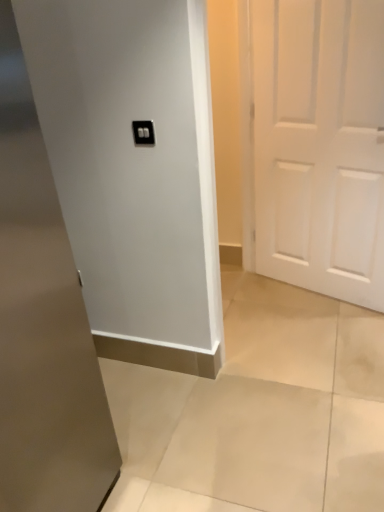
Question: Considering the relative positions of white matte door at right, acting as the first door starting from the back, and black plastic light switch at upper center in the image provided, is white matte door at right, acting as the first door starting from the back, to the right of black plastic light switch at upper center from the viewer's perspective?

Choices:
 (A) no
 (B) yes

Answer: (B)

Question: Is white matte door at right, acting as the first door starting from the back, smaller than black plastic light switch at upper center?

Choices:
 (A) no
 (B) yes

Answer: (A)

Question: From the image's perspective, is white matte door at right, placed as the 1th door when sorted from right to left, on black plastic light switch at upper center?

Choices:
 (A) no
 (B) yes

Answer: (B)

Question: Is white matte door at right, which is the second door from left to right, aimed at black plastic light switch at upper center?

Choices:
 (A) yes
 (B) no

Answer: (A)

Question: Is white matte door at right, acting as the first door starting from the back, positioned beyond the bounds of black plastic light switch at upper center?

Choices:
 (A) no
 (B) yes

Answer: (B)

Question: From the image's perspective, is white matte door at right, placed as the 1th door when sorted from right to left, located above or below white glossy door at center, the second door when ordered from back to front?

Choices:
 (A) below
 (B) above

Answer: (B)

Question: Is white matte door at right, which is the second door from left to right, in front of or behind white glossy door at center, the 1th door from the left, in the image?

Choices:
 (A) behind
 (B) front

Answer: (A)

Question: Would you say white matte door at right, which is the second door from left to right, is to the left or to the right of white glossy door at center, the 1th door from the left, in the picture?

Choices:
 (A) right
 (B) left

Answer: (A)

Question: Considering the positions of white matte door at right, arranged as the second door when viewed from the front, and white glossy door at center, marked as the 2th door in a right-to-left arrangement, in the image, is white matte door at right, arranged as the second door when viewed from the front, bigger or smaller than white glossy door at center, marked as the 2th door in a right-to-left arrangement,?

Choices:
 (A) small
 (B) big

Answer: (A)

Question: Considering the positions of point (49, 321) and point (147, 135), is point (49, 321) closer or farther from the camera than point (147, 135)?

Choices:
 (A) farther
 (B) closer

Answer: (B)

Question: From their relative heights in the image, would you say white glossy door at center, marked as the 2th door in a right-to-left arrangement, is taller or shorter than black plastic light switch at upper center?

Choices:
 (A) short
 (B) tall

Answer: (B)

Question: Considering the positions of white glossy door at center, the 1th door from the left, and black plastic light switch at upper center in the image, is white glossy door at center, the 1th door from the left, bigger or smaller than black plastic light switch at upper center?

Choices:
 (A) small
 (B) big

Answer: (B)

Question: Based on their positions, is white glossy door at center, the 1th door from the left, located to the left or right of black plastic light switch at upper center?

Choices:
 (A) left
 (B) right

Answer: (A)

Question: Does point (0, 104) appear closer or farther from the camera than point (304, 242)?

Choices:
 (A) farther
 (B) closer

Answer: (B)

Question: From a real-world perspective, is white glossy door at center, marked as the 2th door in a right-to-left arrangement, physically located above or below white matte door at right, placed as the 1th door when sorted from right to left?

Choices:
 (A) below
 (B) above

Answer: (A)